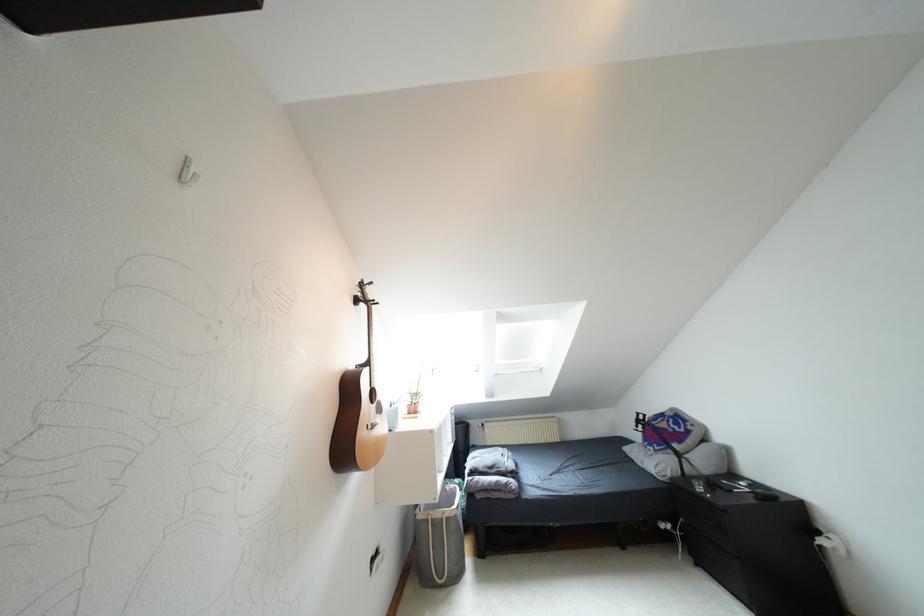
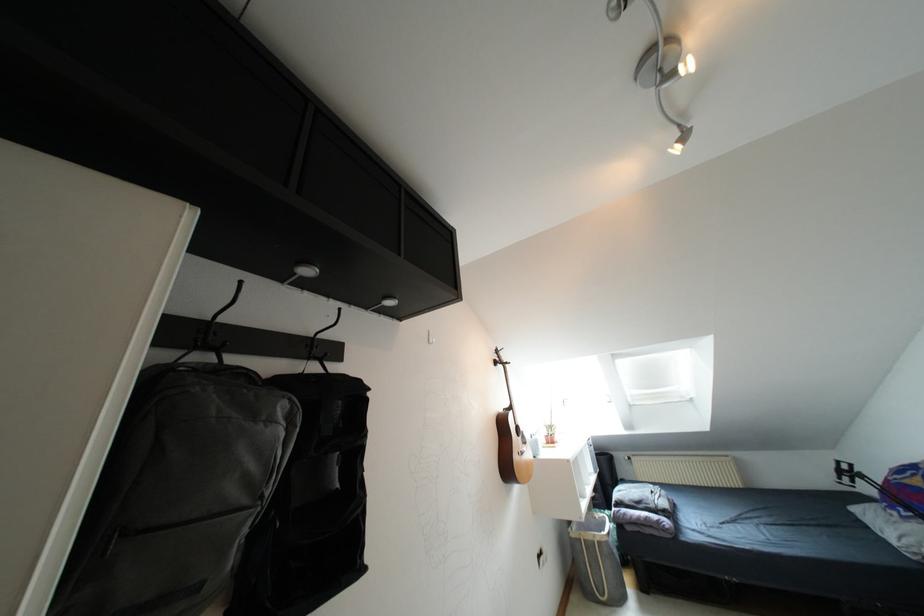
Locate, in the second image, the point that corresponds to point (456, 573) in the first image.

(618, 599)